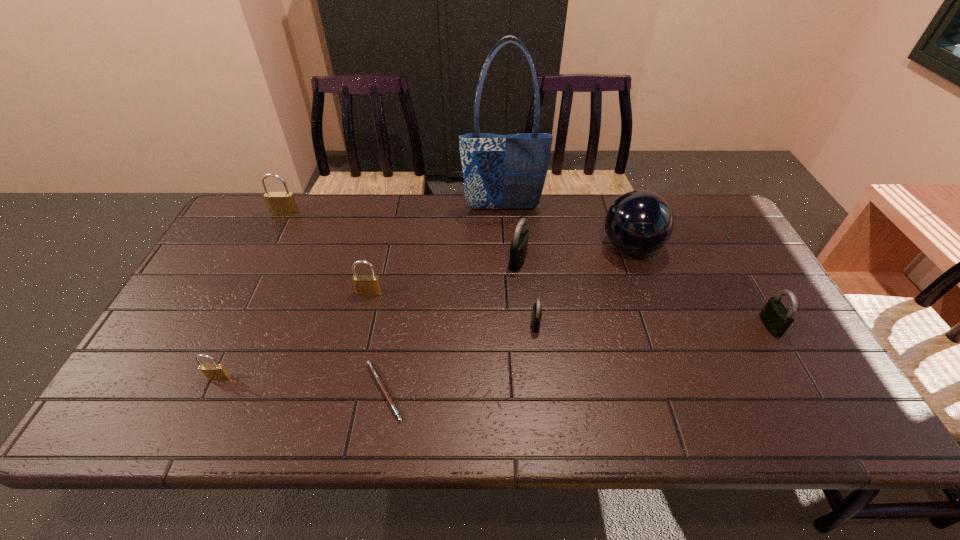
Find the location of a particular element. Image resolution: width=960 pixels, height=540 pixels. vacant region that satisfies the following two spatial constraints: 1. on the front side of the biggest black padlock; 2. on the left side of the rightmost black padlock is located at coordinates (523, 326).

You are a GUI agent. You are given a task and a screenshot of the screen. Output one action in this format:
    pyautogui.click(x=<x>, y=<y>)
    Task: Click on the free region that satisfies the following two spatial constraints: 1. on the front-facing side of the rightmost brass padlock; 2. on the left side of the rightmost black padlock
    The width and height of the screenshot is (960, 540).
    Given the screenshot: What is the action you would take?
    pyautogui.click(x=362, y=326)

Find the location of a particular element. Image resolution: width=960 pixels, height=540 pixels. free space that satisfies the following two spatial constraints: 1. on the front-facing side of the smallest black padlock; 2. on the left side of the tallest object is located at coordinates (510, 324).